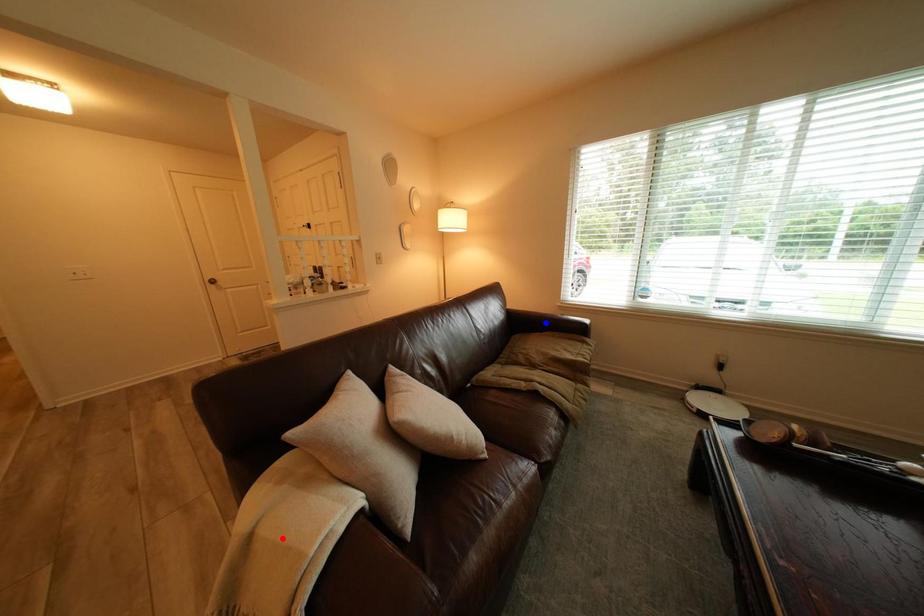
Question: Which of the two points in the image is closer to the camera?

Choices:
 (A) Blue point is closer.
 (B) Red point is closer.

Answer: (B)